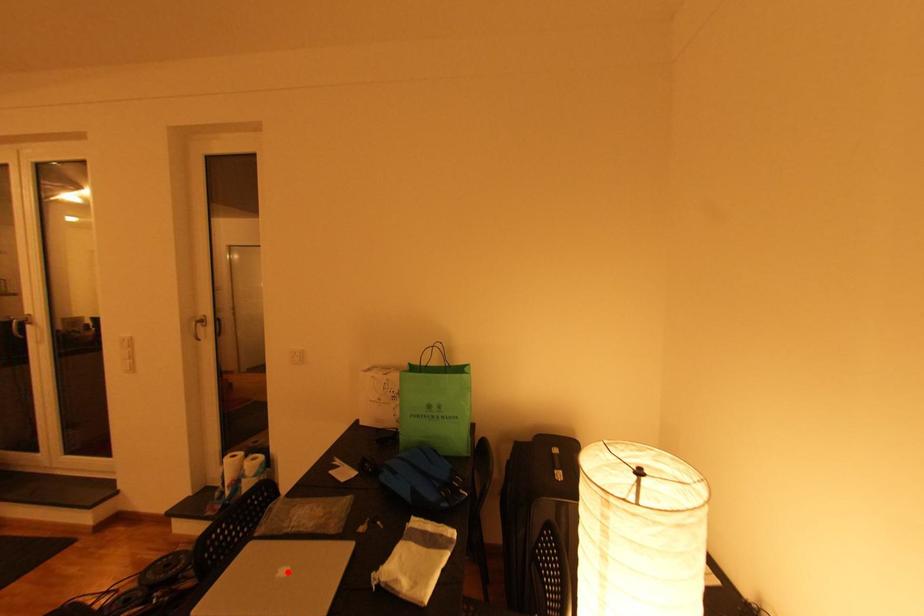
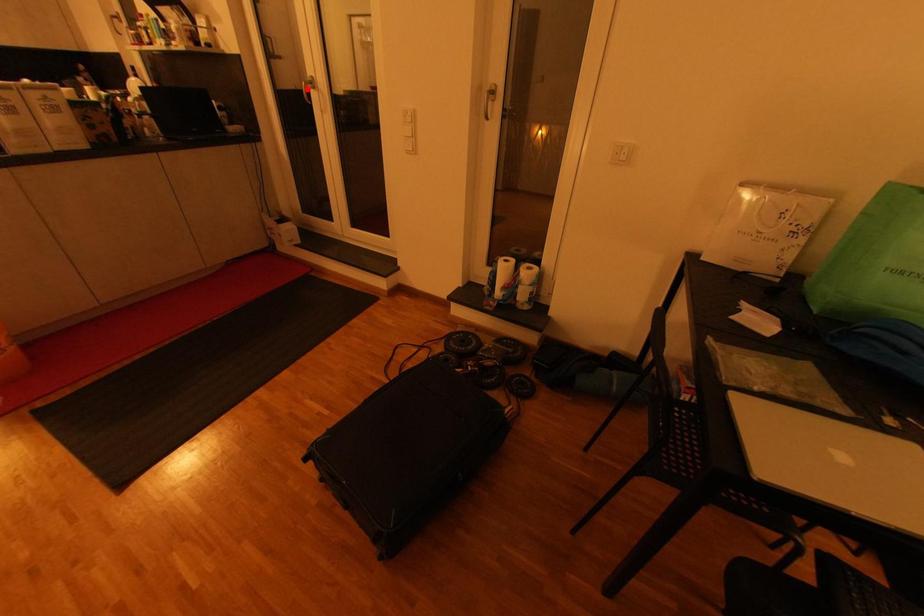
I am providing you with two images of the same scene from different viewpoints. A red point is marked on the first image and another point is marked on the second image. Is the red point in image1 aligned with the point shown in image2?

No